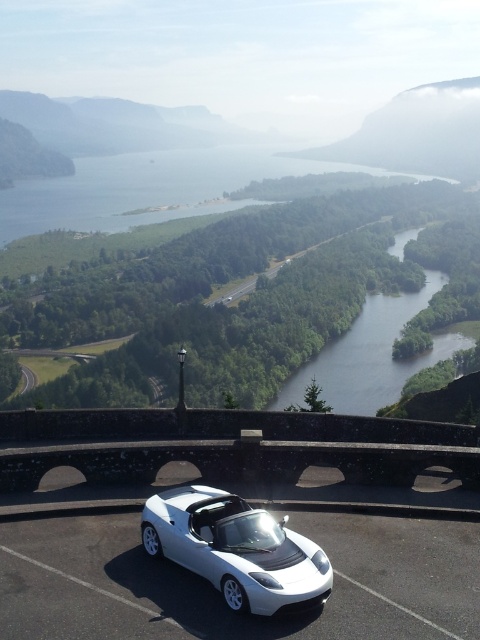
What do you see at coordinates (145, 188) in the screenshot? This screenshot has width=480, height=640. I see `blue water at center` at bounding box center [145, 188].

Is point (7, 218) positioned before point (311, 364)?

That is False.

Locate an element on the screen. The height and width of the screenshot is (640, 480). blue water at center is located at coordinates (145, 188).

Which is below, white glossy car at center or green smooth water at center?

white glossy car at center

Does white glossy car at center have a larger size compared to green smooth water at center?

No, white glossy car at center is not bigger than green smooth water at center.

Which is in front, point (235, 611) or point (345, 364)?

Point (235, 611)

What are the coordinates of `white glossy car at center` in the screenshot? It's located at [x=236, y=548].

Is blue water at center shorter than white glossy car at center?

Incorrect, blue water at center's height does not fall short of white glossy car at center's.

Who is more distant from viewer, (213, 161) or (257, 577)?

Point (213, 161)

This screenshot has height=640, width=480. I want to click on blue water at center, so click(x=145, y=188).

You are a GUI agent. You are given a task and a screenshot of the screen. Output one action in this format:
    pyautogui.click(x=<x>, y=<y>)
    Task: Click on the blue water at center
    
    Given the screenshot: What is the action you would take?
    pyautogui.click(x=145, y=188)